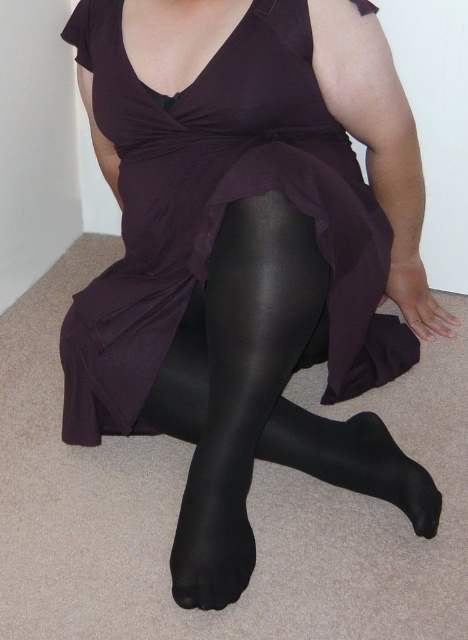
You are organizing a fashion show and need to ensure that the models can move comfortably. Given the image of the person wearing the matte purple dress at center and the shiny black tights at center, which clothing item might restrict movement more due to its size?

The matte purple dress at center has a larger width than the shiny black tights at center, so it might restrict movement more due to its size.

You are a fashion designer trying to create a new outfit. You have the matte purple dress at center and the shiny black tights at center in your collection. Which item would you choose if you want to emphasize the upper body area more?

The matte purple dress at center is taller than the shiny black tights at center, so choosing the matte purple dress at center would emphasize the upper body area more because it extends higher up.

You are a fashion designer who needs to create a new outfit using the matte purple dress at center and the black satin sock at lower center. Which item should you use as the main component of the outfit and why?

The matte purple dress at center should be used as the main component because it is larger in size than the black satin sock at lower center, making it the dominant piece in the outfit.